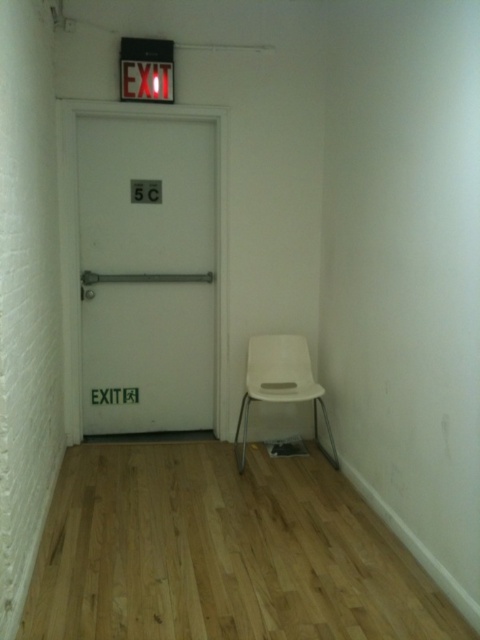
Question: Which of the following is the farthest from the observer?

Choices:
 (A) white matte door at center
 (B) white plastic chair at lower right
 (C) red plastic exit sign at upper center

Answer: (A)

Question: Considering the real-world distances, which object is farthest from the white matte door at center?

Choices:
 (A) red plastic exit sign at upper center
 (B) white plastic chair at lower right

Answer: (B)

Question: Which point is closer to the camera?

Choices:
 (A) (238, 426)
 (B) (134, 90)
 (C) (186, 305)

Answer: (B)

Question: Does white plastic chair at lower right come in front of red plastic exit sign at upper center?

Choices:
 (A) no
 (B) yes

Answer: (B)

Question: Is white matte door at center smaller than white plastic chair at lower right?

Choices:
 (A) no
 (B) yes

Answer: (A)

Question: Does white matte door at center appear on the left side of red plastic exit sign at upper center?

Choices:
 (A) yes
 (B) no

Answer: (A)